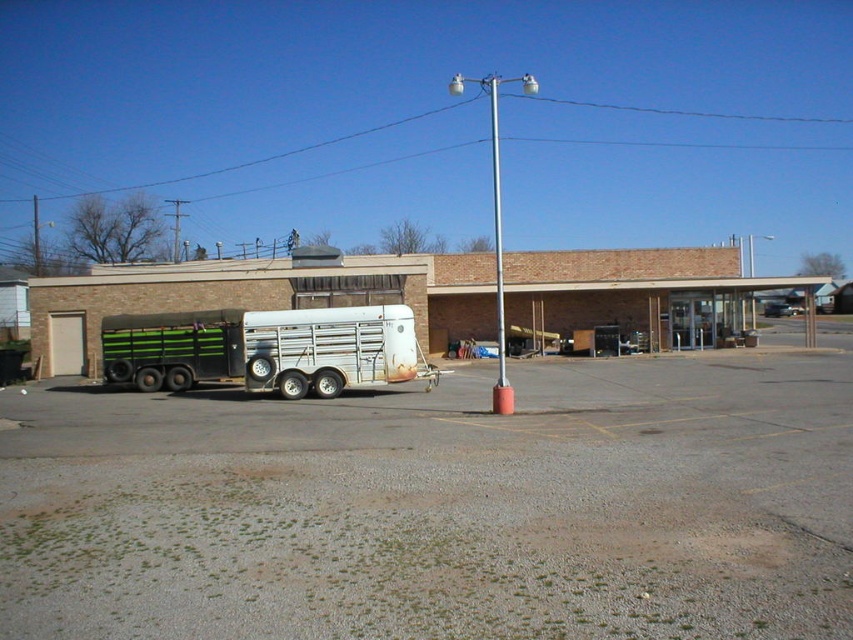
You are driving a delivery truck and need to park in the parking spot next to the gravel at lower left. The parking spot is to the right of the green striped metal trailer truck at left. Can you park your truck there without overlapping the trailer?

The gravel at lower left is positioned on the right side of green striped metal trailer truck at left, so yes, you can park your truck in the parking spot to the right of the trailer without overlapping it.

You are a delivery person driving a truck that is 18 feet long. You arrive at this location and need to park your truck in the same area where the green striped metal trailer truck at left is currently parked. Based on the gravel at lower left, which is part of the parking area, can you fit your truck there without overlapping the gravel?

The gravel at lower left is 17.35 feet away from the green striped metal trailer truck at left. Since your truck is 18 feet long, which is longer than the available space between the gravel and the trailer, you cannot park your truck there without overlapping the gravel.

You are driving a delivery van that is 6 meters long. You want to park your van between the green striped metal trailer truck at left and the building. Is there enough space between them to park your van?

The distance between the green striped metal trailer truck at left and the building is 21.05 meters. Since your van is only 6 meters long, there is more than enough space to park it between them.